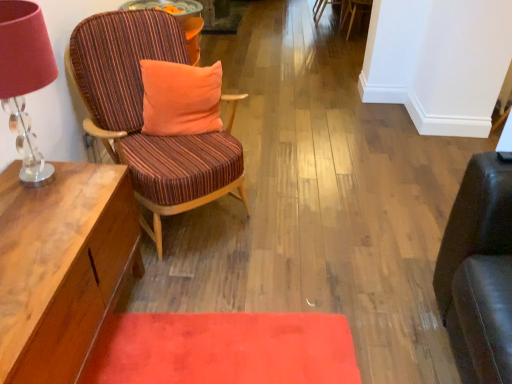
What do you see at coordinates (178, 19) in the screenshot?
I see `wooden side table at left` at bounding box center [178, 19].

Find the location of a particular element. wooden chair with striped upholstery at center, the 2th chair viewed from the left is located at coordinates (322, 8).

Locate an element on the screen. This screenshot has height=384, width=512. striped fabric chair at upper center, the first chair positioned from the right is located at coordinates (353, 12).

What do you see at coordinates (353, 12) in the screenshot?
I see `striped fabric chair at upper center, which appears as the third chair when viewed from the left` at bounding box center [353, 12].

At what (x,y) coordinates should I click in order to perform the action: click on translucent glass table lamp at left. Please return your answer as a coordinate pair (x, y). Looking at the image, I should click on (25, 79).

Where is `striped fabric chair at left, the third chair when ordered from back to front`? The image size is (512, 384). striped fabric chair at left, the third chair when ordered from back to front is located at coordinates (142, 115).

This screenshot has width=512, height=384. I want to click on wooden side table at left, so click(x=178, y=19).

Does striped fabric chair at left, the third chair viewed from the right, have a greater width compared to velvety red mat at lower center?

No.

Is striped fabric chair at left, marked as the first chair in a left-to-right arrangement, bigger than velvety red mat at lower center?

Yes.

Locate an element on the screen. chair lying on the left of velvety red mat at lower center is located at coordinates (142, 115).

From a real-world perspective, which object stands above the other?

wooden side table at left is physically above.

Find the location of a particular element. side table lying on the left of orange velvety pillow at center is located at coordinates (178, 19).

In the image, is orange velvety pillow at center positioned in front of or behind wooden side table at left?

Visually, orange velvety pillow at center is located in front of wooden side table at left.

Can you confirm if orange velvety pillow at center is bigger than wooden side table at left?

Yes, orange velvety pillow at center is bigger than wooden side table at left.

Considering the sizes of velvety red mat at lower center and wooden side table at left in the image, is velvety red mat at lower center taller or shorter than wooden side table at left?

velvety red mat at lower center is shorter than wooden side table at left.

Between point (191, 348) and point (197, 41), which one is positioned in front?

The point (191, 348) is in front.

From the image's perspective, which object appears higher, velvety red mat at lower center or wooden side table at left?

wooden side table at left.

Considering the sizes of objects wooden chair with striped upholstery at center, which is the first chair from top to bottom, and translucent glass table lamp at left in the image provided, who is wider, wooden chair with striped upholstery at center, which is the first chair from top to bottom, or translucent glass table lamp at left?

Wider between the two is wooden chair with striped upholstery at center, which is the first chair from top to bottom.

In the image, is wooden chair with striped upholstery at center, which is the first chair from top to bottom, positioned in front of or behind translucent glass table lamp at left?

Visually, wooden chair with striped upholstery at center, which is the first chair from top to bottom, is located behind translucent glass table lamp at left.

Which is more to the left, wooden chair with striped upholstery at center, the 2th chair viewed from the left, or translucent glass table lamp at left?

From the viewer's perspective, translucent glass table lamp at left appears more on the left side.

Can you tell me how much wooden chair with striped upholstery at center, the third chair positioned from the bottom, and translucent glass table lamp at left differ in facing direction?

0.418 degrees.

Is striped fabric chair at left, marked as the first chair in a left-to-right arrangement, bigger or smaller than wooden chair with striped upholstery at center, the third chair positioned from the bottom?

In the image, striped fabric chair at left, marked as the first chair in a left-to-right arrangement, appears to be larger than wooden chair with striped upholstery at center, the third chair positioned from the bottom.

Is striped fabric chair at left, the third chair when ordered from back to front, wider or thinner than wooden chair with striped upholstery at center, acting as the 1th chair starting from the back?

In the image, striped fabric chair at left, the third chair when ordered from back to front, appears to be wider than wooden chair with striped upholstery at center, acting as the 1th chair starting from the back.

Which is correct: striped fabric chair at left, the 3th chair in the top-to-bottom sequence, is inside wooden chair with striped upholstery at center, placed as the 2th chair when sorted from right to left, or outside of it?

The correct answer is: outside.

In the scene shown: From a real-world perspective, is striped fabric chair at left, the third chair viewed from the right, physically located above or below orange velvety pillow at center?

Clearly, from a real-world perspective, striped fabric chair at left, the third chair viewed from the right, is below orange velvety pillow at center.

What's the angular difference between striped fabric chair at left, arranged as the 1th chair when viewed from the front, and orange velvety pillow at center's facing directions?

The angular difference between striped fabric chair at left, arranged as the 1th chair when viewed from the front, and orange velvety pillow at center is 24.6 degrees.

Which is nearer, (110,94) or (208,78)?

Point (110,94) is closer to the camera than point (208,78).

Which of these two, striped fabric chair at left, the third chair viewed from the right, or orange velvety pillow at center, is thinner?

orange velvety pillow at center.

Between velvety red mat at lower center and translucent glass table lamp at left, which one has smaller size?

With smaller size is velvety red mat at lower center.

Considering the relative positions of velvety red mat at lower center and translucent glass table lamp at left in the image provided, is velvety red mat at lower center in front of translucent glass table lamp at left?

No, velvety red mat at lower center is further to the viewer.

Is velvety red mat at lower center at the left side of translucent glass table lamp at left?

In fact, velvety red mat at lower center is to the right of translucent glass table lamp at left.

From a real-world perspective, who is located higher, velvety red mat at lower center or translucent glass table lamp at left?

translucent glass table lamp at left.

The height and width of the screenshot is (384, 512). What are the coordinates of `mat that is under the striped fabric chair at left, marked as the first chair in a left-to-right arrangement (from a real-world perspective)` in the screenshot? It's located at (224, 349).

You are a GUI agent. You are given a task and a screenshot of the screen. Output one action in this format:
    pyautogui.click(x=<x>, y=<y>)
    Task: Click on the side table above the orange velvety pillow at center (from a real-world perspective)
    
    Given the screenshot: What is the action you would take?
    pyautogui.click(x=178, y=19)

Considering their positions, is wooden chair with striped upholstery at center, which is the first chair from top to bottom, positioned closer to wooden side table at left than orange velvety pillow at center?

Among the two, orange velvety pillow at center is located nearer to wooden side table at left.

Estimate the real-world distances between objects in this image. Which object is further from wooden side table at left, striped fabric chair at upper center, which appears as the third chair when viewed from the left, or translucent glass table lamp at left?

striped fabric chair at upper center, which appears as the third chair when viewed from the left, is further to wooden side table at left.

In the scene shown: Which object lies nearer to the anchor point striped fabric chair at upper center, acting as the second chair starting from the top, striped fabric chair at left, arranged as the 1th chair when viewed from the front, or orange velvety pillow at center?

orange velvety pillow at center.

Which object lies further to the anchor point striped fabric chair at upper center, acting as the second chair starting from the top, wooden chair with striped upholstery at center, which is the first chair from top to bottom, or velvety red mat at lower center?

Based on the image, velvety red mat at lower center appears to be further to striped fabric chair at upper center, acting as the second chair starting from the top.

From the image, which object appears to be farther from orange velvety pillow at center, striped fabric chair at upper center, acting as the second chair starting from the top, or translucent glass table lamp at left?

striped fabric chair at upper center, acting as the second chair starting from the top, is further to orange velvety pillow at center.

Which object lies nearer to the anchor point striped fabric chair at upper center, which is counted as the second chair, starting from the front, orange velvety pillow at center or wooden chair with striped upholstery at center, acting as the 1th chair starting from the back?

Among the two, wooden chair with striped upholstery at center, acting as the 1th chair starting from the back, is located nearer to striped fabric chair at upper center, which is counted as the second chair, starting from the front.

From the image, which object appears to be farther from striped fabric chair at left, which is the first chair from bottom to top, translucent glass table lamp at left or striped fabric chair at upper center, which is counted as the second chair, starting from the front?

striped fabric chair at upper center, which is counted as the second chair, starting from the front, is further to striped fabric chair at left, which is the first chair from bottom to top.

Based on their spatial positions, is velvety red mat at lower center or wooden chair with striped upholstery at center, the 2th chair viewed from the left, further from translucent glass table lamp at left?

wooden chair with striped upholstery at center, the 2th chair viewed from the left, is positioned further to the anchor translucent glass table lamp at left.

What are the coordinates of `pillow between translucent glass table lamp at left and striped fabric chair at upper center, which appears as the third chair when viewed from the left, in the front-back direction` in the screenshot? It's located at (180, 98).

Where is `pillow between striped fabric chair at left, arranged as the 1th chair when viewed from the front, and striped fabric chair at upper center, the first chair positioned from the right, in the front-back direction`? pillow between striped fabric chair at left, arranged as the 1th chair when viewed from the front, and striped fabric chair at upper center, the first chair positioned from the right, in the front-back direction is located at coordinates (180, 98).

At what (x,y) coordinates should I click in order to perform the action: click on side table positioned between orange velvety pillow at center and striped fabric chair at upper center, the second chair positioned from the bottom, from near to far. Please return your answer as a coordinate pair (x, y). Looking at the image, I should click on (178, 19).

The width and height of the screenshot is (512, 384). What are the coordinates of `pillow between striped fabric chair at left, the 3th chair in the top-to-bottom sequence, and wooden chair with striped upholstery at center, placed as the 2th chair when sorted from right to left, along the z-axis` in the screenshot? It's located at (180, 98).